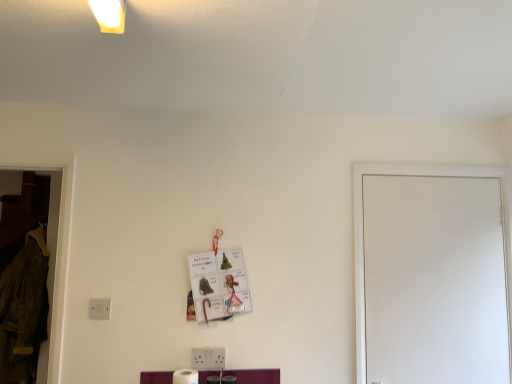
Question: Considering the relative sizes of velvet brown coat at left and white matte door at right in the image provided, is velvet brown coat at left smaller than white matte door at right?

Choices:
 (A) no
 (B) yes

Answer: (A)

Question: Is velvet brown coat at left positioned beyond the bounds of white matte door at right?

Choices:
 (A) no
 (B) yes

Answer: (B)

Question: From the image's perspective, does velvet brown coat at left appear higher than white matte door at right?

Choices:
 (A) no
 (B) yes

Answer: (A)

Question: Is velvet brown coat at left bigger than white matte door at right?

Choices:
 (A) no
 (B) yes

Answer: (B)

Question: From a real-world perspective, is velvet brown coat at left beneath white matte door at right?

Choices:
 (A) yes
 (B) no

Answer: (A)

Question: Is point (101, 314) positioned closer to the camera than point (52, 226)?

Choices:
 (A) farther
 (B) closer

Answer: (B)

Question: Considering the positions of white plastic electric outlet at lower left and velvet brown coat at left in the image, is white plastic electric outlet at lower left taller or shorter than velvet brown coat at left?

Choices:
 (A) tall
 (B) short

Answer: (B)

Question: From a real-world perspective, is white plastic electric outlet at lower left positioned above or below velvet brown coat at left?

Choices:
 (A) below
 (B) above

Answer: (B)

Question: Is white plastic electric outlet at lower left spatially inside velvet brown coat at left, or outside of it?

Choices:
 (A) inside
 (B) outside

Answer: (B)

Question: In terms of width, does velvet brown coat at left look wider or thinner when compared to white matte toilet paper at lower center?

Choices:
 (A) thin
 (B) wide

Answer: (B)

Question: From a real-world perspective, is velvet brown coat at left positioned above or below white matte toilet paper at lower center?

Choices:
 (A) below
 (B) above

Answer: (B)

Question: Does point 66,195 appear closer or farther from the camera than point 194,379?

Choices:
 (A) closer
 (B) farther

Answer: (B)

Question: In terms of size, does velvet brown coat at left appear bigger or smaller than white matte toilet paper at lower center?

Choices:
 (A) small
 (B) big

Answer: (B)

Question: Is white matte toilet paper at lower center inside the boundaries of velvet brown coat at left, or outside?

Choices:
 (A) outside
 (B) inside

Answer: (A)

Question: In the image, is white matte toilet paper at lower center positioned in front of or behind velvet brown coat at left?

Choices:
 (A) behind
 (B) front

Answer: (B)